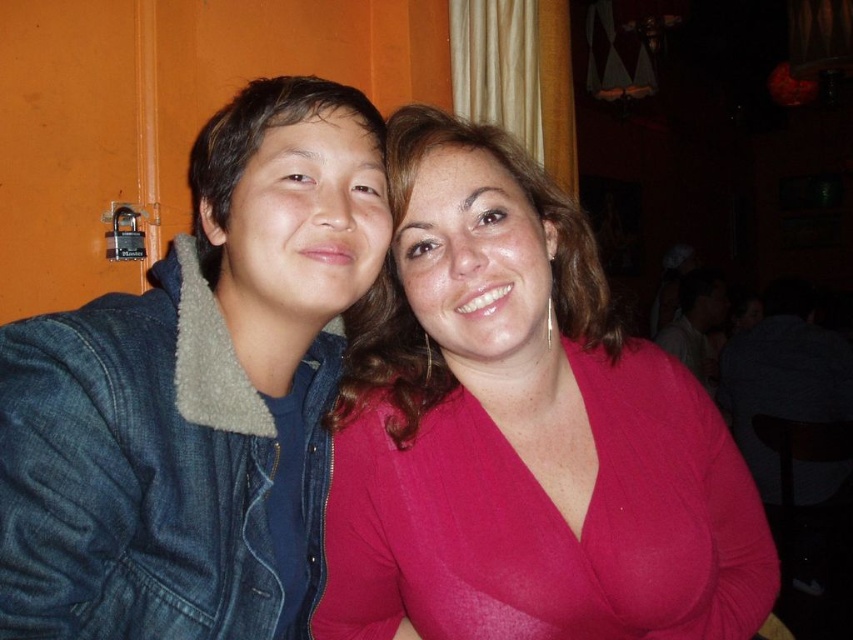
You are standing in front of the two people in the image. Which object is at the coordinates point (521,433)?

The matte pink blouse at center is located at point (521,433).

You are standing in front of the image and want to know the position of the denim jacket at left. What are its coordinates?

The denim jacket at left is located at point (x=196, y=394).

You are taking a photo of two people in an indoor setting. You notice two points marked in the image. The first point is at coordinates point (62,490) and the second point is at point (708,369). Which of these points is closer to the camera?

Point (62,490) is closer to the camera than point (708,369).